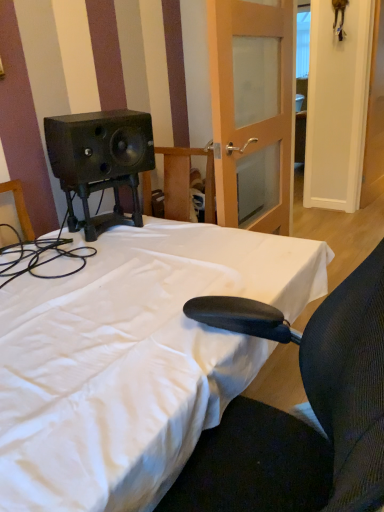
Question: Would you consider white wooden door at upper right, which appears as the second door when viewed from the left, to be distant from white fabric bed at center?

Choices:
 (A) yes
 (B) no

Answer: (A)

Question: Can you confirm if white wooden door at upper right, which appears as the second door when viewed from the left, is taller than white fabric bed at center?

Choices:
 (A) no
 (B) yes

Answer: (B)

Question: Does white wooden door at upper right, which is counted as the first door, starting from the right, appear on the right side of white fabric bed at center?

Choices:
 (A) yes
 (B) no

Answer: (A)

Question: Is white wooden door at upper right, which appears as the second door when viewed from the left, positioned with its back to white fabric bed at center?

Choices:
 (A) no
 (B) yes

Answer: (A)

Question: Does white wooden door at upper right, which is counted as the first door, starting from the right, turn towards white fabric bed at center?

Choices:
 (A) no
 (B) yes

Answer: (B)

Question: Can you confirm if white wooden door at upper right, which appears as the second door when viewed from the left, is bigger than white fabric bed at center?

Choices:
 (A) no
 (B) yes

Answer: (A)

Question: Is white fabric bed at center shorter than wooden frosted glass door at center, the 2th door in the right-to-left sequence?

Choices:
 (A) yes
 (B) no

Answer: (A)

Question: Are white fabric bed at center and wooden frosted glass door at center, the 2th door in the right-to-left sequence, beside each other?

Choices:
 (A) yes
 (B) no

Answer: (B)

Question: From a real-world perspective, is white fabric bed at center under wooden frosted glass door at center, the 2th door in the right-to-left sequence?

Choices:
 (A) yes
 (B) no

Answer: (A)

Question: From the image's perspective, is white fabric bed at center below wooden frosted glass door at center, the 2th door in the right-to-left sequence?

Choices:
 (A) no
 (B) yes

Answer: (B)

Question: Considering the relative sizes of white fabric bed at center and wooden frosted glass door at center, the 2th door in the right-to-left sequence, in the image provided, is white fabric bed at center taller than wooden frosted glass door at center, the 2th door in the right-to-left sequence,?

Choices:
 (A) yes
 (B) no

Answer: (B)

Question: Considering the relative positions of white fabric bed at center and wooden frosted glass door at center, which is the first door in left-to-right order, in the image provided, is white fabric bed at center in front of wooden frosted glass door at center, which is the first door in left-to-right order,?

Choices:
 (A) yes
 (B) no

Answer: (A)

Question: Would you consider wooden frosted glass door at center, the 2th door in the right-to-left sequence, to be distant from white fabric bed at center?

Choices:
 (A) no
 (B) yes

Answer: (A)